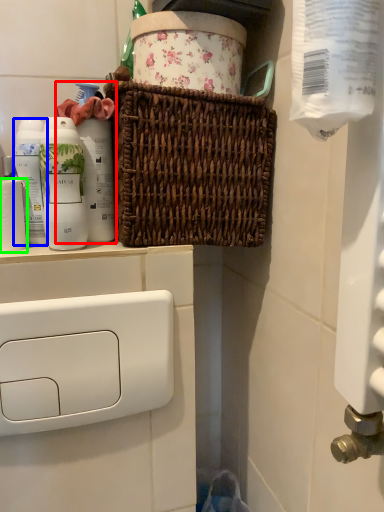
Question: Estimate the real-world distances between objects in this image. Which object is farther from cleaning product (highlighted by a red box), mouthwash (highlighted by a blue box) or toilet paper (highlighted by a green box)?

Choices:
 (A) mouthwash
 (B) toilet paper

Answer: (B)